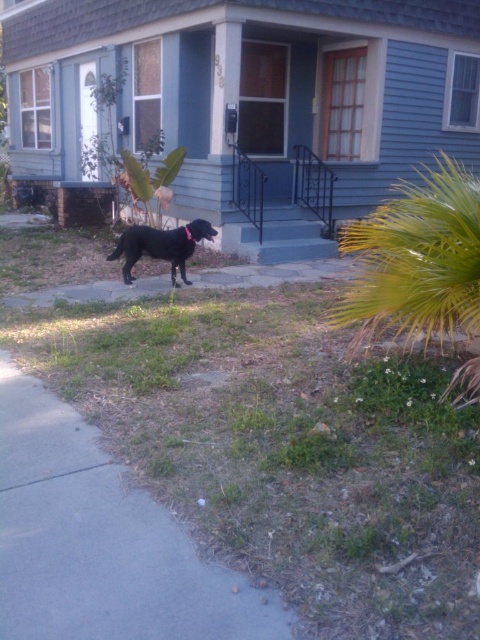
Question: Can you confirm if gray concrete pavement at lower left is positioned to the right of black matte dog at center?

Choices:
 (A) no
 (B) yes

Answer: (B)

Question: Which object is farther from the camera taking this photo?

Choices:
 (A) gray concrete pavement at lower left
 (B) black matte dog at center

Answer: (B)

Question: Is gray concrete pavement at lower left to the right of black matte dog at center from the viewer's perspective?

Choices:
 (A) no
 (B) yes

Answer: (B)

Question: Is gray concrete pavement at lower left wider than black matte dog at center?

Choices:
 (A) no
 (B) yes

Answer: (B)